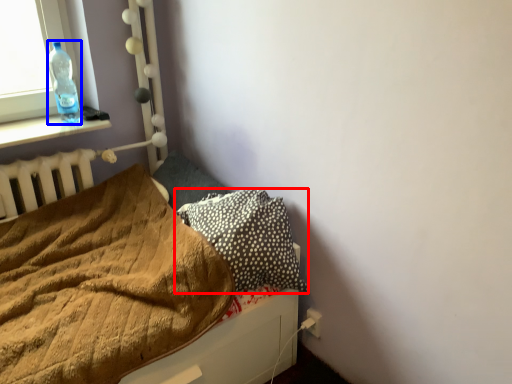
Question: Which object is further to the camera taking this photo, pillow (highlighted by a red box) or bottle (highlighted by a blue box)?

Choices:
 (A) pillow
 (B) bottle

Answer: (B)